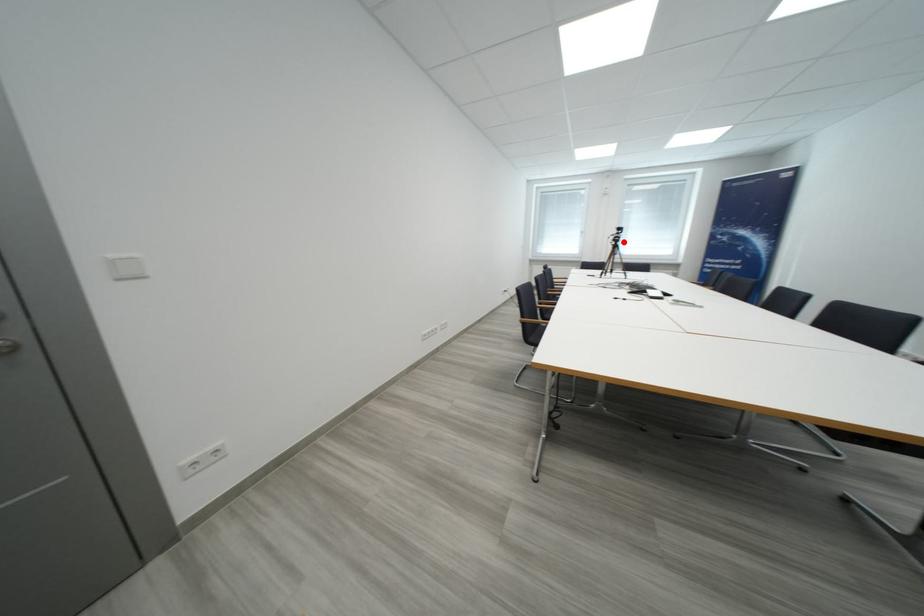
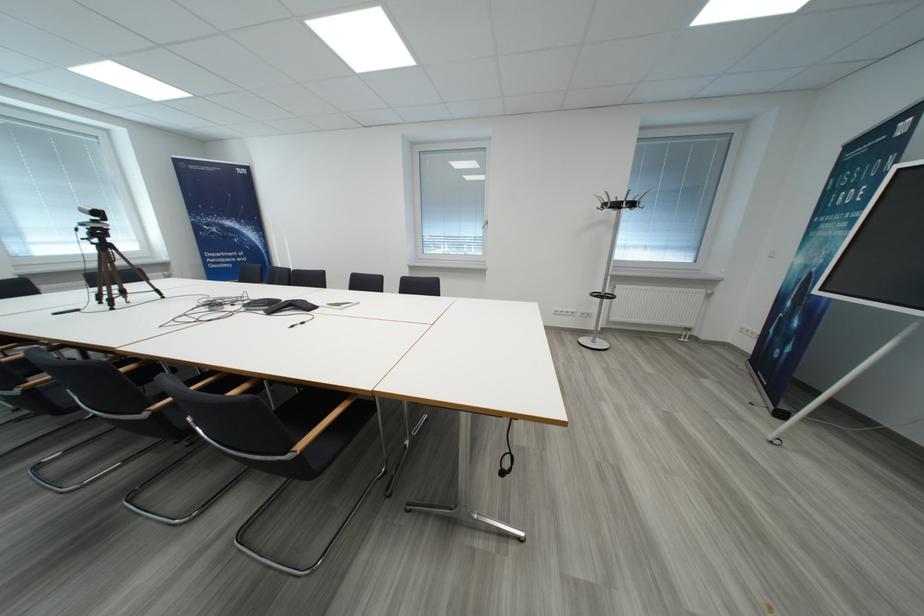
Question: I am providing you with two images of the same scene from different viewpoints. A red point is shown in image1. For the corresponding object point in image2, is it positioned nearer or farther from the camera?

Choices:
 (A) Nearer
 (B) Farther

Answer: (B)